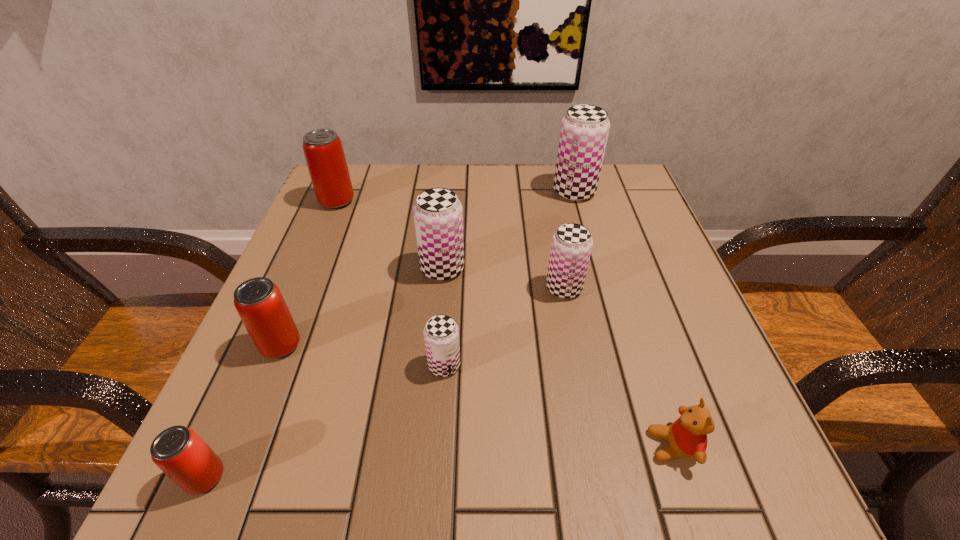
Where is `the farthest purple beer can`? The width and height of the screenshot is (960, 540). the farthest purple beer can is located at coordinates (584, 131).

At what (x,y) coordinates should I click in order to perform the action: click on the tallest object. Please return your answer as a coordinate pair (x, y). The width and height of the screenshot is (960, 540). Looking at the image, I should click on (584, 131).

Find the location of a particular element. the farthest pink beer can is located at coordinates (323, 150).

The height and width of the screenshot is (540, 960). In order to click on the third smallest purple beer can in this screenshot , I will do `click(438, 216)`.

Identify the location of the second smallest purple beer can. (571, 247).

Locate an element on the screen. the second biggest pink beer can is located at coordinates (x=258, y=301).

I want to click on the smallest purple beer can, so click(x=441, y=333).

The image size is (960, 540). Find the location of `the nearest pink beer can`. the nearest pink beer can is located at coordinates click(178, 451).

Find the location of `the nearest beer can`. the nearest beer can is located at coordinates (178, 451).

The image size is (960, 540). Identify the location of red teddy bear. (687, 436).